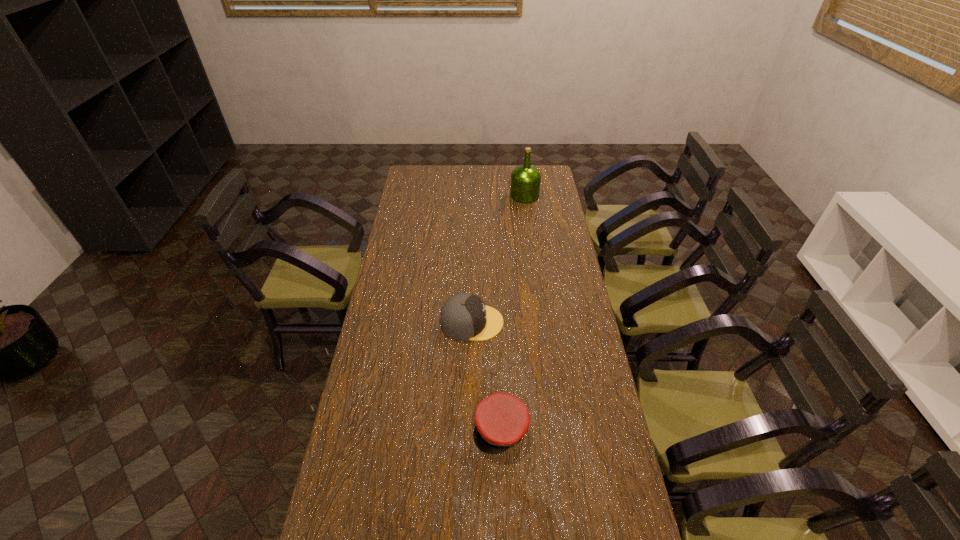
The width and height of the screenshot is (960, 540). In order to click on object that stands as the closest to the farther cap in this screenshot , I will do `click(502, 419)`.